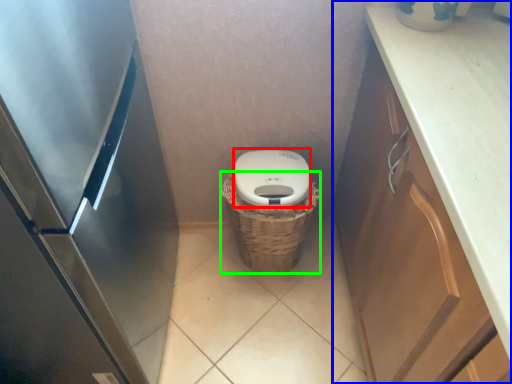
Question: Estimate the real-world distances between objects in this image. Which object is closer to lid (highlighted by a red box), cabinetry (highlighted by a blue box) or basket (highlighted by a green box)?

Choices:
 (A) cabinetry
 (B) basket

Answer: (B)